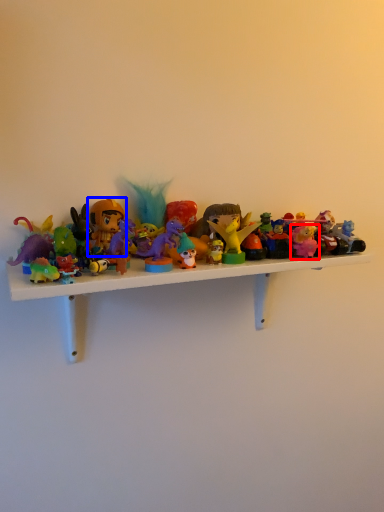
Question: Which object is closer to the camera taking this photo, toy (highlighted by a red box) or toy (highlighted by a blue box)?

Choices:
 (A) toy
 (B) toy

Answer: (B)